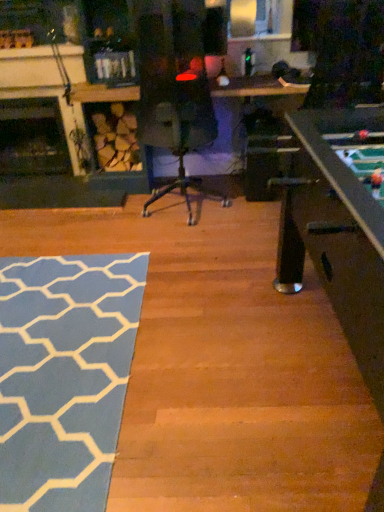
Question: Is blue textured rug at lower left aimed at dark wood fireplace at left, which is counted as the 1th fireplace, starting from the back?

Choices:
 (A) yes
 (B) no

Answer: (B)

Question: From the image's perspective, is blue textured rug at lower left located beneath dark wood fireplace at left, which is counted as the 1th fireplace, starting from the back?

Choices:
 (A) no
 (B) yes

Answer: (B)

Question: Considering the relative positions of blue textured rug at lower left and dark wood fireplace at left, which is counted as the 1th fireplace, starting from the back, in the image provided, is blue textured rug at lower left in front of dark wood fireplace at left, which is counted as the 1th fireplace, starting from the back,?

Choices:
 (A) no
 (B) yes

Answer: (B)

Question: Can you confirm if blue textured rug at lower left is positioned to the left of dark wood fireplace at left, acting as the 2th fireplace starting from the front?

Choices:
 (A) yes
 (B) no

Answer: (B)

Question: Is blue textured rug at lower left taller than dark wood fireplace at left, which is counted as the 1th fireplace, starting from the back?

Choices:
 (A) no
 (B) yes

Answer: (A)

Question: Is blue textured rug at lower left to the right of dark wood fireplace at left, which is counted as the 1th fireplace, starting from the back, from the viewer's perspective?

Choices:
 (A) no
 (B) yes

Answer: (B)

Question: Considering the relative sizes of dark wood fireplace at left, acting as the 2th fireplace starting from the front, and dark wood fireplace at left, the first fireplace when ordered from front to back, in the image provided, is dark wood fireplace at left, acting as the 2th fireplace starting from the front, taller than dark wood fireplace at left, the first fireplace when ordered from front to back,?

Choices:
 (A) no
 (B) yes

Answer: (A)

Question: Is dark wood fireplace at left, which is counted as the 1th fireplace, starting from the back, outside dark wood fireplace at left, the 2th fireplace viewed from the back?

Choices:
 (A) yes
 (B) no

Answer: (A)

Question: Is dark wood fireplace at left, acting as the 2th fireplace starting from the front, bigger than dark wood fireplace at left, the first fireplace when ordered from front to back?

Choices:
 (A) yes
 (B) no

Answer: (A)

Question: Are dark wood fireplace at left, which is counted as the 1th fireplace, starting from the back, and dark wood fireplace at left, the 2th fireplace viewed from the back, located far from each other?

Choices:
 (A) no
 (B) yes

Answer: (A)

Question: Is dark wood fireplace at left, which is counted as the 1th fireplace, starting from the back, at the right side of dark wood fireplace at left, the first fireplace when ordered from front to back?

Choices:
 (A) yes
 (B) no

Answer: (B)

Question: From a real-world perspective, is dark wood fireplace at left, which is counted as the 1th fireplace, starting from the back, positioned under dark wood fireplace at left, the 2th fireplace viewed from the back, based on gravity?

Choices:
 (A) yes
 (B) no

Answer: (A)

Question: Does dark wood fireplace at left, acting as the 2th fireplace starting from the front, have a greater height compared to blue textured rug at lower left?

Choices:
 (A) yes
 (B) no

Answer: (A)